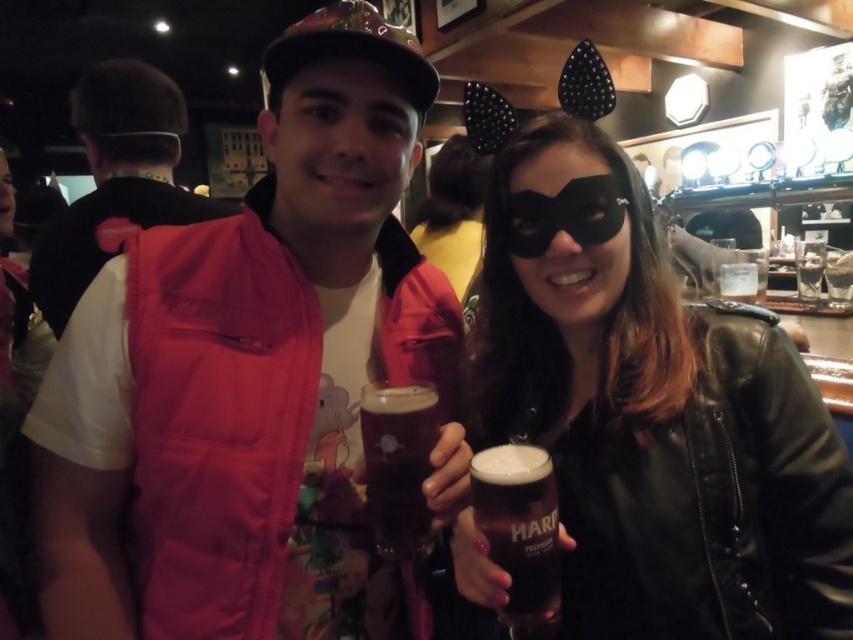
You are a photographer at the bar and need to position the black leather mask at center and the pink fleece vest at left in your shot. If you want to ensure both objects are clearly visible, which one should you focus on first considering their sizes?

The black leather mask at center is smaller than the pink fleece vest at left, so you should focus on the pink fleece vest at left first as it is larger and easier to capture clearly.

You are a bartender at the bar and need to reach for the dark amber glass at center. Is the pink fabric vest at center blocking your access to it?

The pink fabric vest at center is located above the dark amber glass at center, so it might block your access to the glass depending on its position and your reach.

Consider the image. You are at a bar and want to order a drink. The bartender points to the point at coordinate (651, 412). What object is located at that point?

The point at coordinate (651, 412) corresponds to the black leather mask at center.